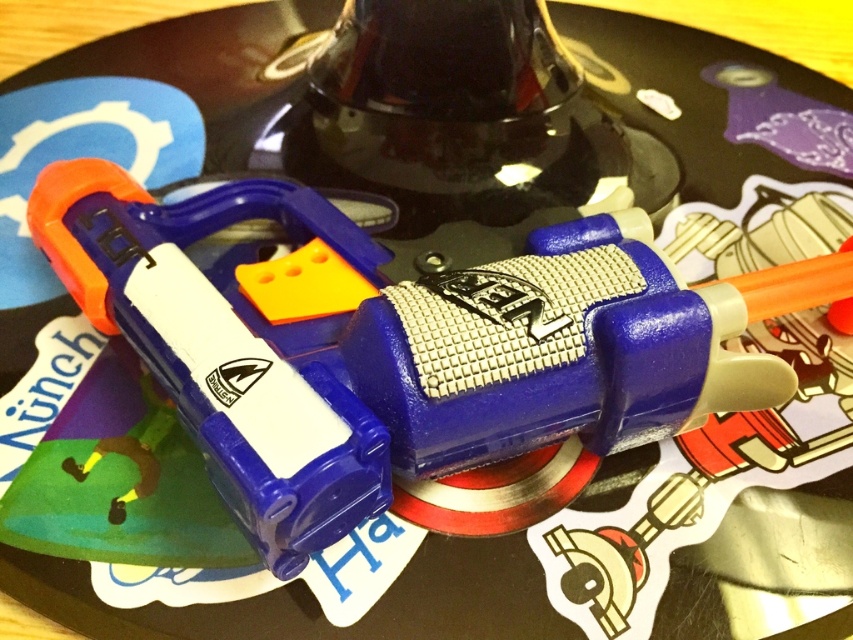
Question: Is the position of blue plastic toy gun at center more distant than that of matte plastic toy gun at center?

Choices:
 (A) yes
 (B) no

Answer: (A)

Question: Which point is farther to the camera?

Choices:
 (A) (268, 496)
 (B) (355, 275)

Answer: (B)

Question: Is blue plastic toy gun at center below matte plastic toy gun at center?

Choices:
 (A) no
 (B) yes

Answer: (B)

Question: Which point is closer to the camera taking this photo?

Choices:
 (A) (248, 538)
 (B) (613, 273)

Answer: (A)

Question: Can you confirm if blue plastic toy gun at center is bigger than matte plastic toy gun at center?

Choices:
 (A) yes
 (B) no

Answer: (A)

Question: Which object is closer to the camera taking this photo?

Choices:
 (A) blue plastic toy gun at center
 (B) matte plastic toy gun at center

Answer: (B)